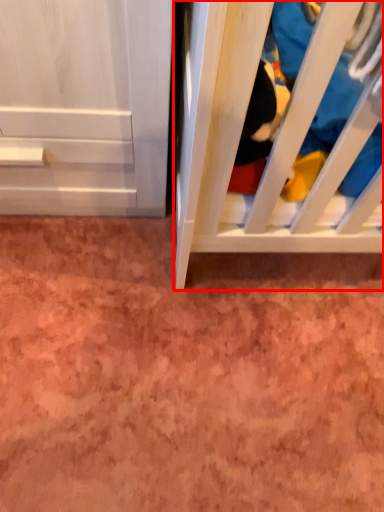
Question: From the image's perspective, what is the correct spatial relationship of furniture (annotated by the red box) in relation to clothing?

Choices:
 (A) below
 (B) above

Answer: (A)